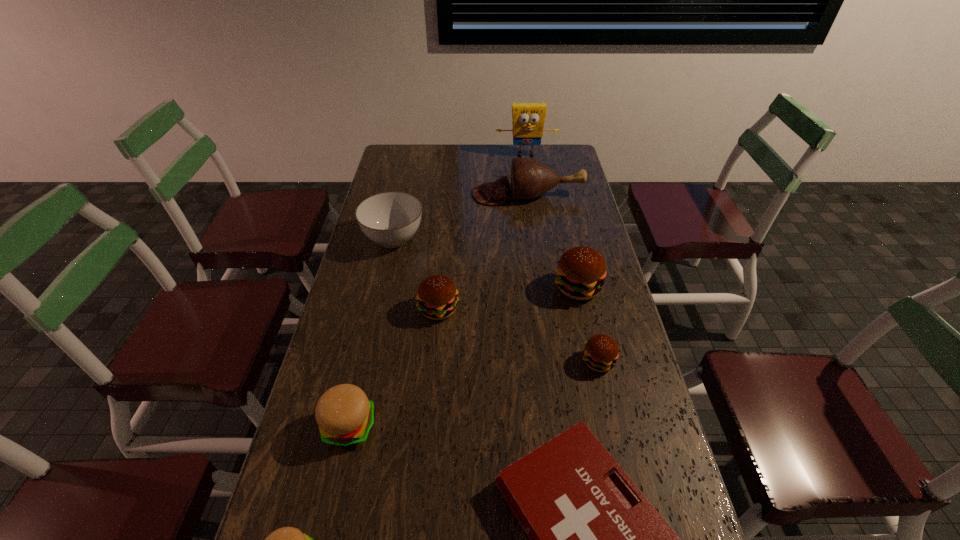
Where is `the nearest brown hamburger`? Image resolution: width=960 pixels, height=540 pixels. the nearest brown hamburger is located at coordinates (600, 354).

This screenshot has height=540, width=960. I want to click on the sixth farthest object, so click(600, 354).

Where is `vacant space located 0.320m on the face of the yellow sponge`? This screenshot has width=960, height=540. vacant space located 0.320m on the face of the yellow sponge is located at coordinates (533, 201).

Where is `vacant region located at the sliced end of the ham`? This screenshot has width=960, height=540. vacant region located at the sliced end of the ham is located at coordinates (407, 194).

You are a GUI agent. You are given a task and a screenshot of the screen. Output one action in this format:
    pyautogui.click(x=<x>, y=<y>)
    Task: Click on the free space located at the sliced end of the ham
    
    Given the screenshot: What is the action you would take?
    pyautogui.click(x=397, y=194)

The width and height of the screenshot is (960, 540). Identify the location of vacant space located at the sliced end of the ham. (407, 194).

In order to click on vacant region located on the front of the biggest brown hamburger in this screenshot , I will do `click(586, 323)`.

Where is `vacant space located on the back of the seventh nearest object`? vacant space located on the back of the seventh nearest object is located at coordinates (401, 206).

Where is `free location located on the back of the second biggest brown hamburger`? free location located on the back of the second biggest brown hamburger is located at coordinates (443, 260).

This screenshot has width=960, height=540. Identify the location of vacant space located on the right of the fourth farthest hamburger. (481, 426).